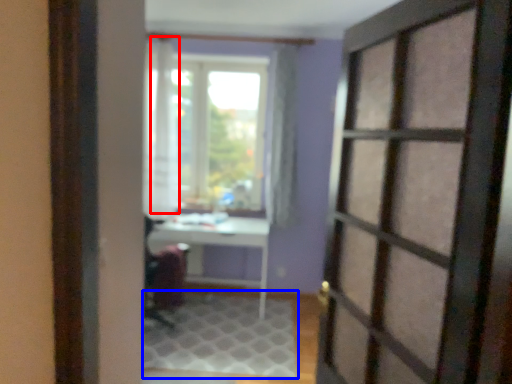
Question: Among these objects, which one is farthest to the camera, curtain (highlighted by a red box) or doormat (highlighted by a blue box)?

Choices:
 (A) curtain
 (B) doormat

Answer: (A)